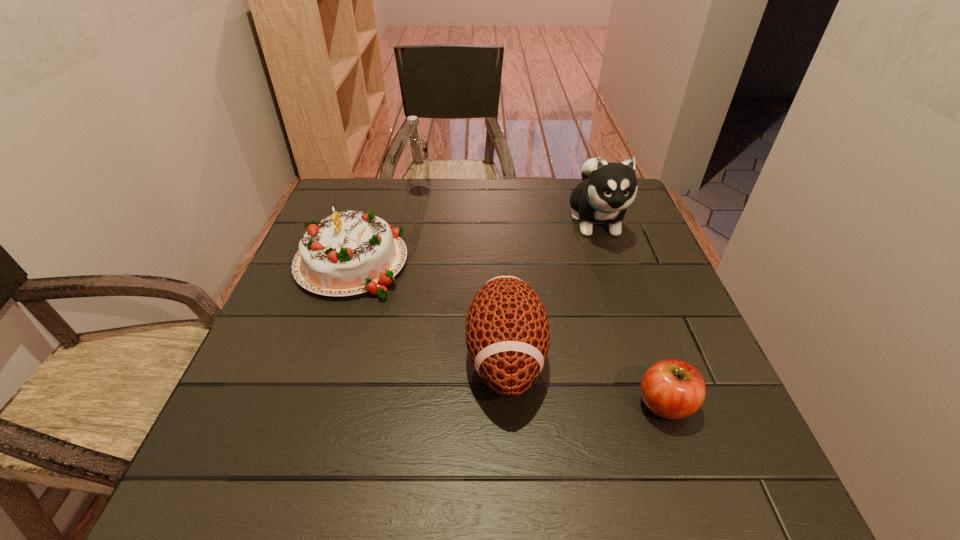
Where is `vodka that is at the far edge`? vodka that is at the far edge is located at coordinates (415, 147).

This screenshot has width=960, height=540. What are the coordinates of `puppy present at the far edge` in the screenshot? It's located at (607, 189).

Identify the location of object located in the left edge section of the desktop. This screenshot has height=540, width=960. (348, 253).

Where is `puppy present at the right edge`? The height and width of the screenshot is (540, 960). puppy present at the right edge is located at coordinates (607, 189).

I want to click on apple present at the right edge, so click(x=672, y=389).

You are a GUI agent. You are given a task and a screenshot of the screen. Output one action in this format:
    pyautogui.click(x=<x>, y=<y>)
    Task: Click on the object present at the far right corner
    Image resolution: width=960 pixels, height=540 pixels.
    Given the screenshot: What is the action you would take?
    pyautogui.click(x=607, y=189)

At what (x,y) coordinates should I click in order to perform the action: click on free point at the far edge. Please return your answer as a coordinate pair (x, y). Image resolution: width=960 pixels, height=540 pixels. Looking at the image, I should click on (523, 206).

I want to click on vacant area at the near edge, so click(324, 461).

The image size is (960, 540). In order to click on vacant space at the left edge of the desktop in this screenshot , I will do (x=275, y=356).

In the image, there is a desktop. At what (x,y) coordinates should I click in order to perform the action: click on free space at the right edge. Please return your answer as a coordinate pair (x, y). Looking at the image, I should click on (613, 279).